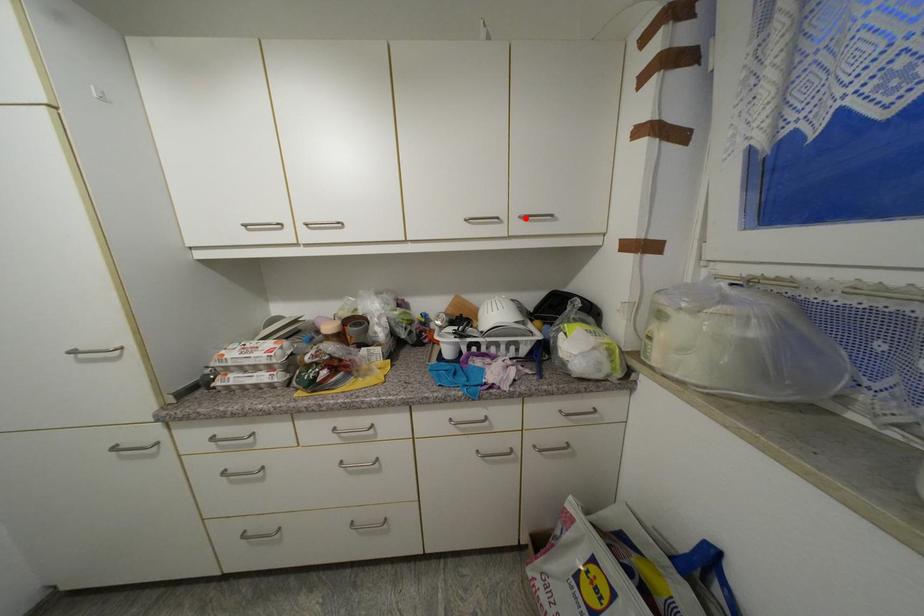
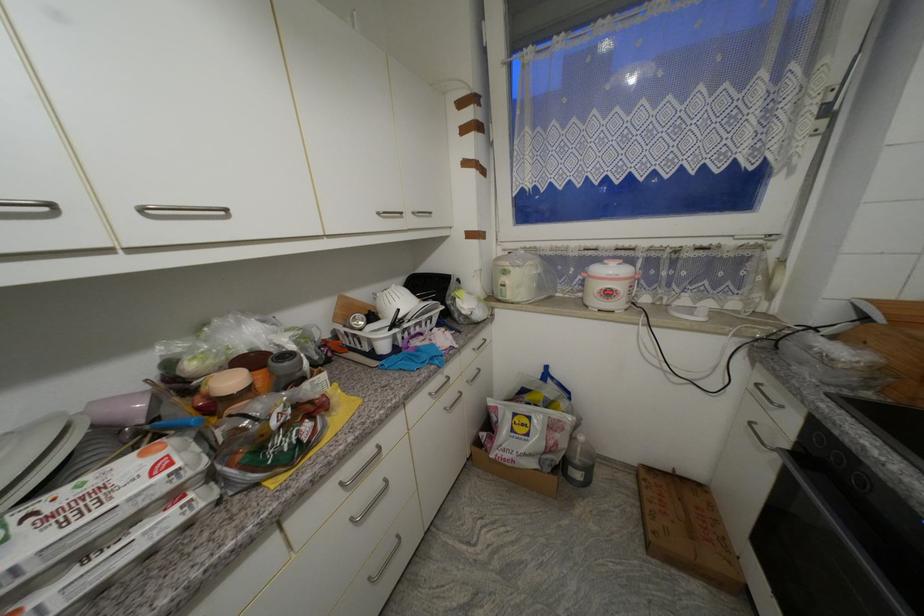
Find the pixel in the second image that matches the highlighted location in the first image.

(419, 215)